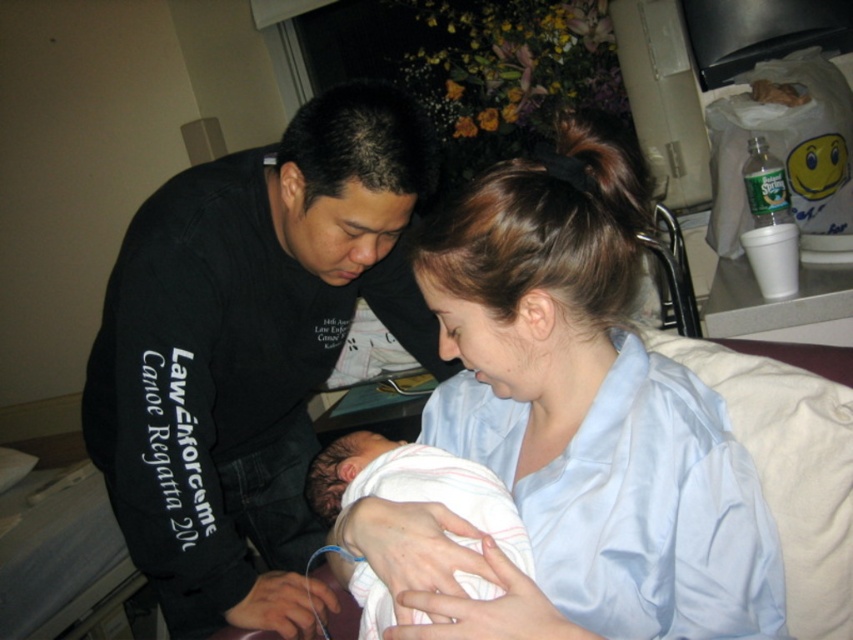
You are a photographer who wants to capture a closeup of the light blue satin shirt at center and the black matte shirt at center. Since you can only focus on one shirt at a time, which shirt should you focus on first to ensure the taller one is in focus?

The black matte shirt at center is taller than the light blue satin shirt at center, so you should focus on the black matte shirt at center first to ensure it is in focus.

You are a photographer in the room and want to take a photo of the black matte shirt at center and the white soft cloth at center. From your current position, which object is closer to you?

The black matte shirt at center is closer to you because the white soft cloth at center is behind it.

You are a photographer in the room and want to capture the black matte shirt at center and the white soft cloth at center in the same frame. Can you adjust your camera angle so that both objects are visible without one blocking the other?

The black matte shirt at center is positioned over the white soft cloth at center, so adjusting the camera angle might not be sufficient to avoid one blocking the other. You may need to reposition the objects or move the camera to a different angle where both are visible without overlap.